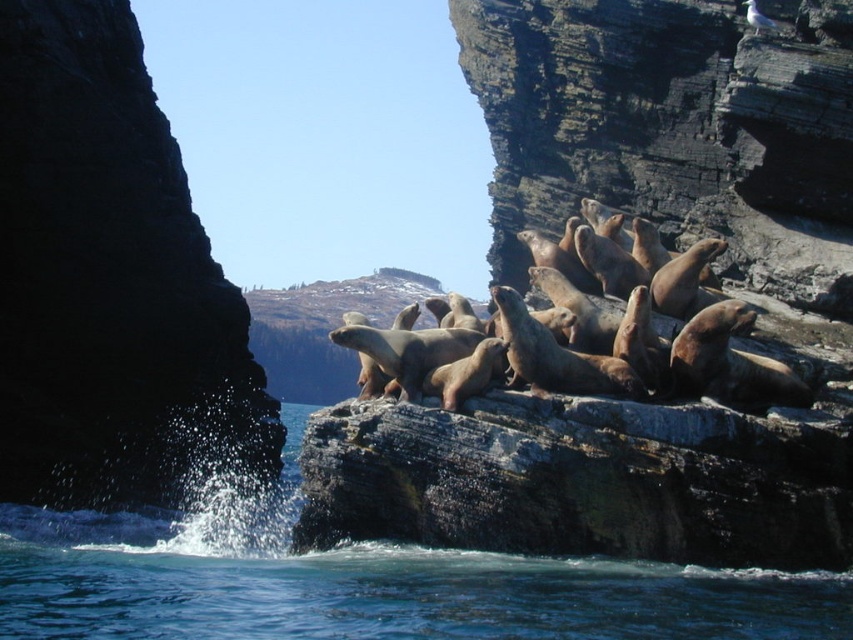
Question: Is dark rock cliff at left thinner than clear blue water at lower center?

Choices:
 (A) no
 (B) yes

Answer: (B)

Question: Which object is positioned closest to the dark rock cliff at left?

Choices:
 (A) clear blue water at lower center
 (B) blue liquid water at lower center

Answer: (A)

Question: Does clear blue water at lower center appear on the left side of smooth gray rock at center?

Choices:
 (A) no
 (B) yes

Answer: (B)

Question: Among these points, which one is farthest from the camera?

Choices:
 (A) (776, 576)
 (B) (161, 140)
 (C) (547, 426)
 (D) (270, 600)

Answer: (B)

Question: Where is dark rock cliff at left located in relation to smooth gray rock at center in the image?

Choices:
 (A) below
 (B) above

Answer: (B)

Question: Which object appears farthest from the camera in this image?

Choices:
 (A) blue liquid water at lower center
 (B) clear blue water at lower center

Answer: (B)